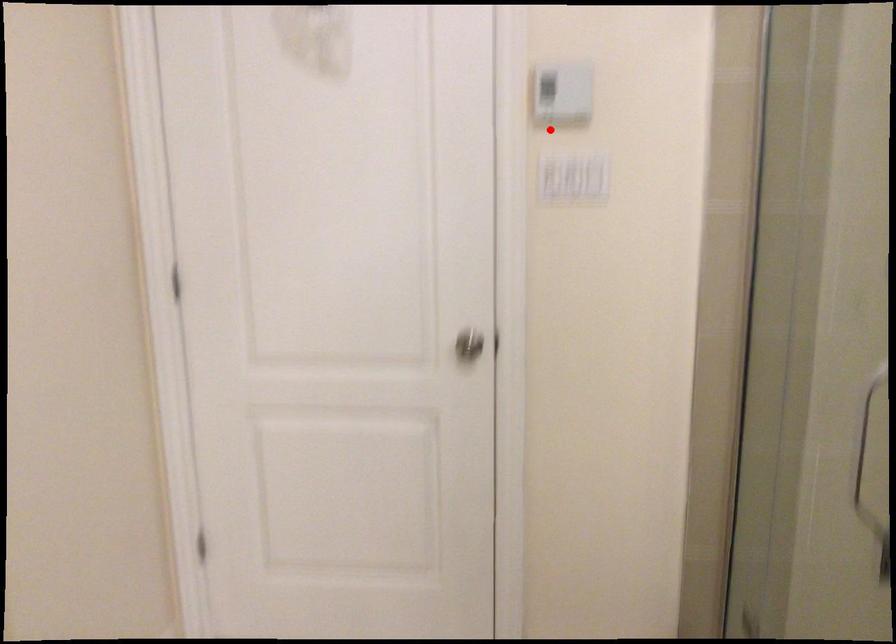
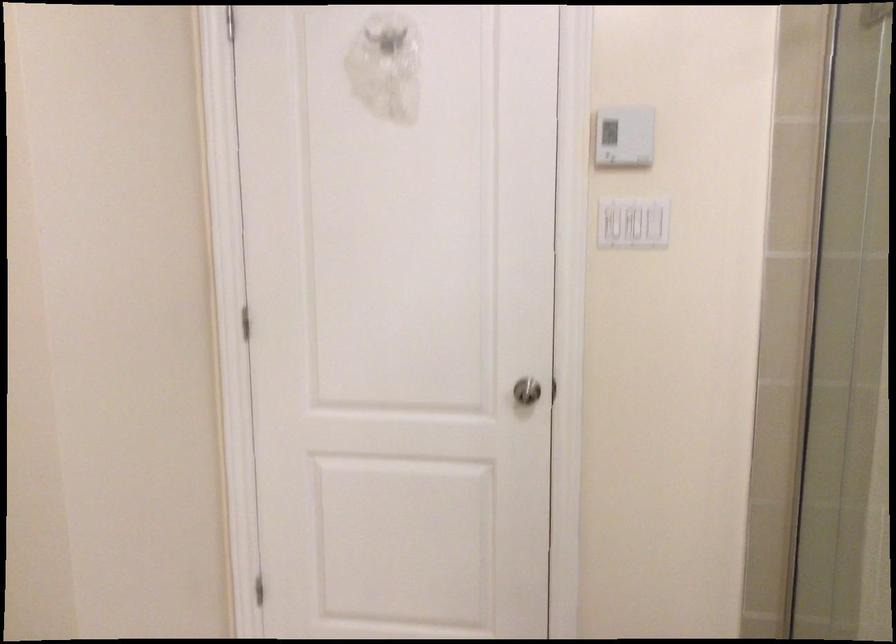
In the second image, find the point that corresponds to the highlighted location in the first image.

(608, 222)